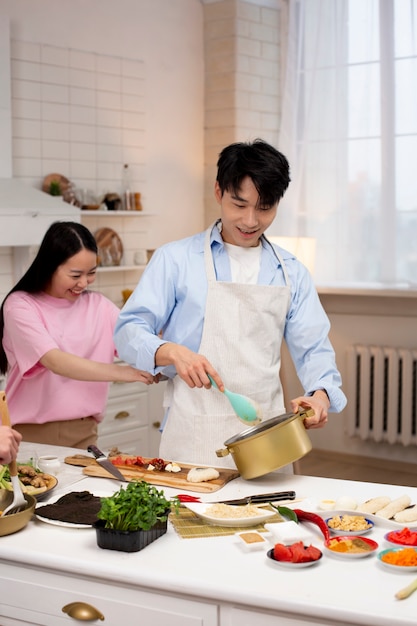
This screenshot has height=626, width=417. What are the coordinates of `windows` in the screenshot? It's located at (403, 151), (361, 168).